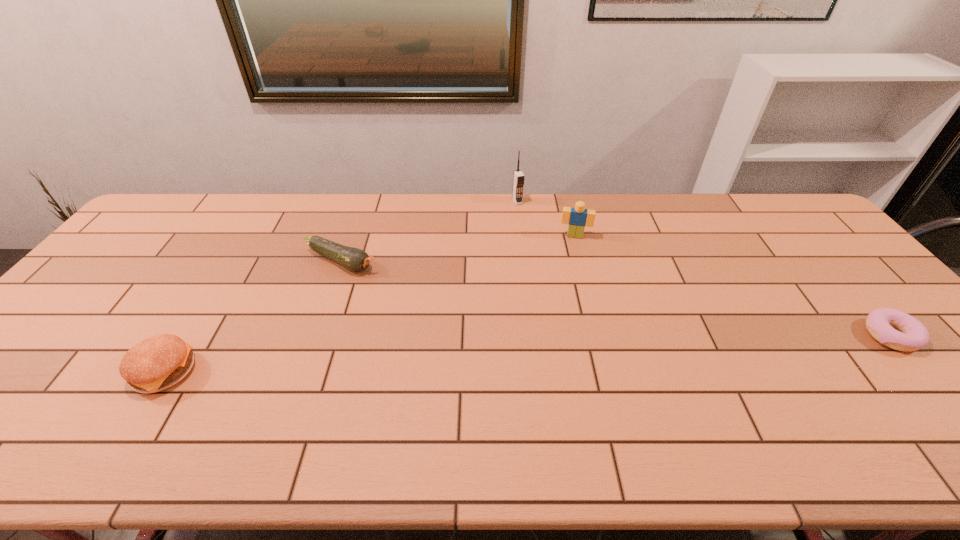
In order to click on vacant space that satisfies the following two spatial constraints: 1. on the back side of the tallest object; 2. on the left side of the leftmost object in this screenshot , I will do `click(271, 201)`.